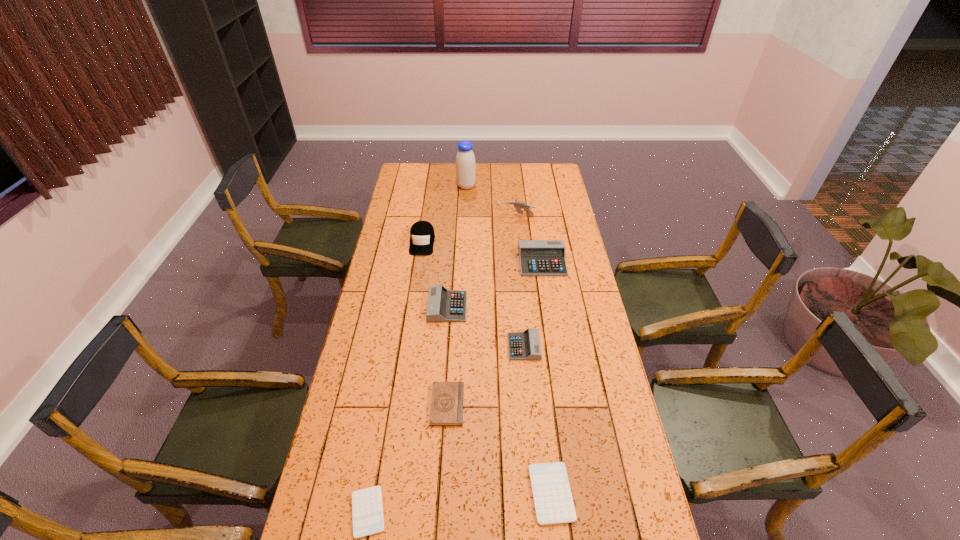
Identify the location of free spot that satisfies the following two spatial constraints: 1. on the front-facing side of the fourth calculator from right to left; 2. on the left side of the cap. (412, 307).